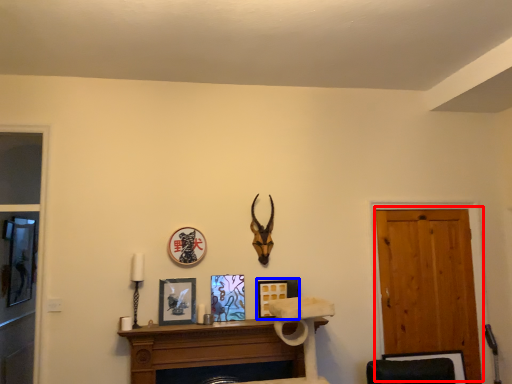
Question: Which object is closer to the camera taking this photo, door (highlighted by a red box) or picture frame (highlighted by a blue box)?

Choices:
 (A) door
 (B) picture frame

Answer: (B)